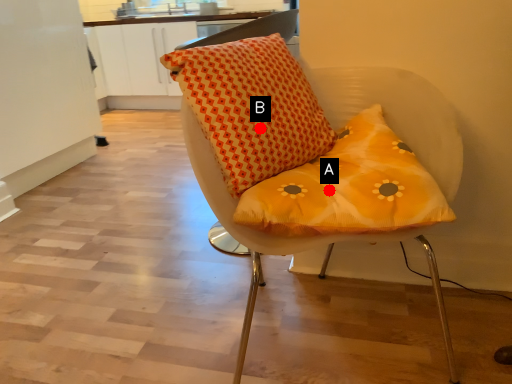
Question: Two points are circled on the image, labeled by A and B beside each circle. Among these points, which one is farthest from the camera?

Choices:
 (A) A is further
 (B) B is further

Answer: (B)